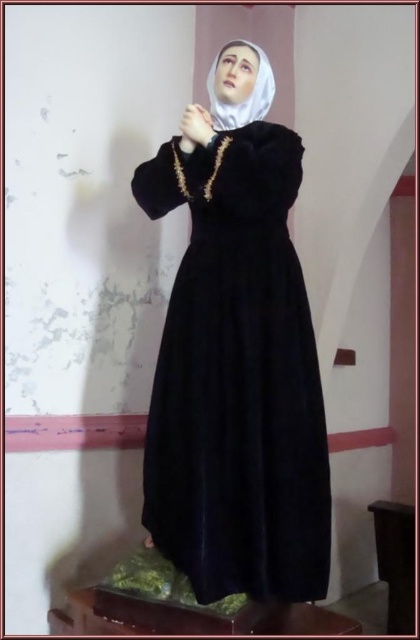
You are an art conservator examining the statue. You need to determine if the velvet black dress at center is positioned higher than the matte black hand at center. Based on the statue, what can you conclude?

The velvet black dress at center is taller than matte black hand at center, so the dress is positioned higher than the hand.

You are an art conservator examining the statue. You notice the velvet black dress at center and the matte black hand at center. Which object is positioned lower on the statue?

The velvet black dress at center is positioned lower than the matte black hand at center.

You are an art conservator examining the statue. You notice the white matte veil at center and the matte black hand at center. Which object is positioned to the right side of the other?

The white matte veil at center is to the right of the matte black hand at center.